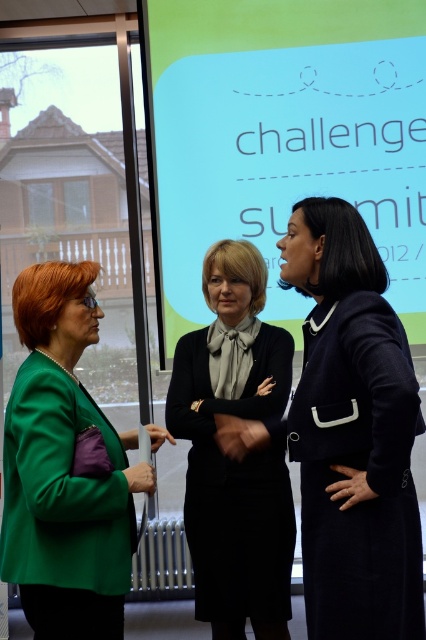
Which is behind, point (385, 180) or point (258, 525)?

The point (385, 180) is behind.

Does matte black screen at center have a greater height compared to matte black dress at center?

Correct, matte black screen at center is much taller as matte black dress at center.

Between point (371, 100) and point (218, 634), which one is positioned behind?

The point (371, 100) is behind.

Find the location of a particular element. The height and width of the screenshot is (640, 426). matte black screen at center is located at coordinates click(285, 138).

From the picture: Who is positioned more to the left, matte black screen at center or navy blue coat at center?

From the viewer's perspective, navy blue coat at center appears more on the left side.

Can you confirm if matte black screen at center is thinner than navy blue coat at center?

Incorrect, matte black screen at center's width is not less than navy blue coat at center's.

This screenshot has width=426, height=640. In order to click on matte black screen at center in this screenshot , I will do click(285, 138).

Is green matte blazer at left smaller than matte black dress at center?

Indeed, green matte blazer at left has a smaller size compared to matte black dress at center.

Which is in front, point (103, 497) or point (213, 324)?

Point (103, 497) is in front.

Find the location of a particular element. The height and width of the screenshot is (640, 426). green matte blazer at left is located at coordinates (65, 467).